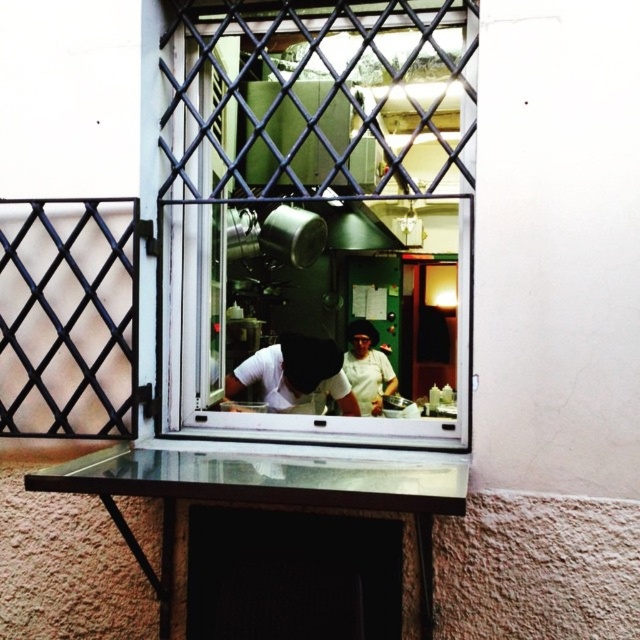
Question: Can you confirm if clear glass window at center is positioned below white fabric chef at center?

Choices:
 (A) no
 (B) yes

Answer: (A)

Question: Is white matte shirt at center bigger than white fabric chef at center?

Choices:
 (A) yes
 (B) no

Answer: (A)

Question: Estimate the real-world distances between objects in this image. Which object is farther from the clear glass window at center?

Choices:
 (A) white matte shirt at center
 (B) white fabric chef at center

Answer: (B)

Question: Estimate the real-world distances between objects in this image. Which object is closer to the white matte shirt at center?

Choices:
 (A) clear glass window at center
 (B) white fabric chef at center

Answer: (B)

Question: Among these objects, which one is farthest from the camera?

Choices:
 (A) white matte shirt at center
 (B) white fabric chef at center

Answer: (A)

Question: From the image, what is the correct spatial relationship of clear glass window at center in relation to white matte shirt at center?

Choices:
 (A) left
 (B) right

Answer: (B)